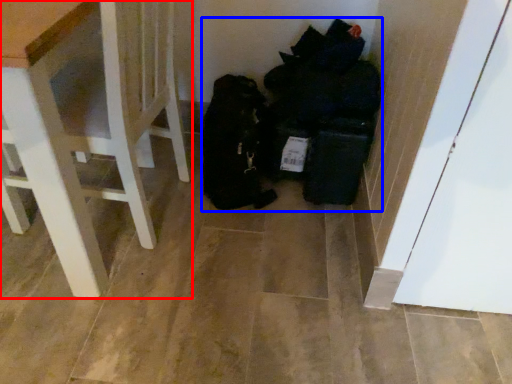
Question: Which of the following is the closest to the observer, furniture (highlighted by a red box) or garbage (highlighted by a blue box)?

Choices:
 (A) furniture
 (B) garbage

Answer: (A)